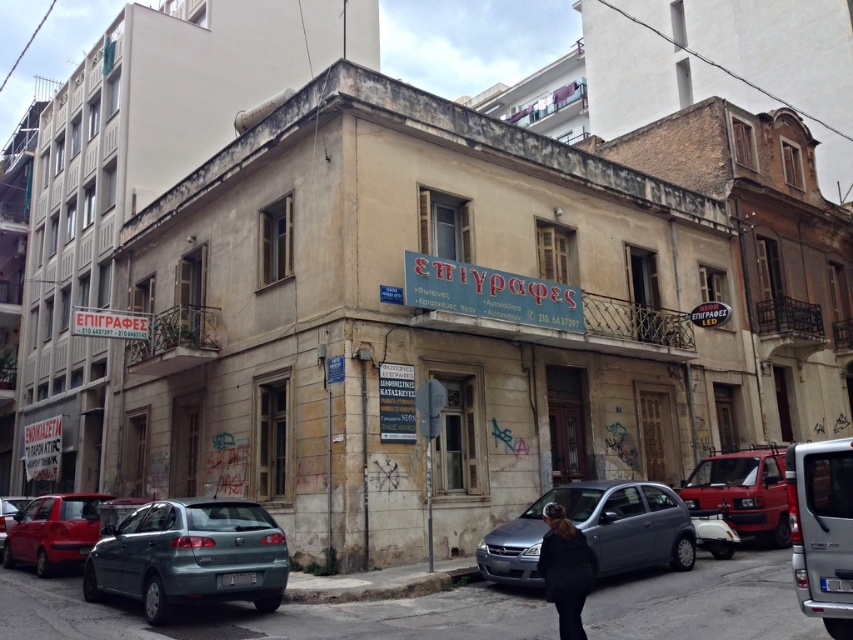
Which of these two, silver metallic van at lower right or matte red van at center, stands shorter?

Standing shorter between the two is silver metallic van at lower right.

Between point (796, 461) and point (762, 483), which one is positioned in front?

Point (796, 461) is in front.

What are the coordinates of `silver metallic van at lower right` in the screenshot? It's located at (822, 529).

Can you confirm if matte red car at lower left is positioned to the right of shiny red sedan at lower left?

Yes, matte red car at lower left is to the right of shiny red sedan at lower left.

Who is positioned more to the right, matte red car at lower left or shiny red sedan at lower left?

matte red car at lower left is more to the right.

Does point (71, 497) lie behind point (4, 518)?

No, it is in front of (4, 518).

Where is `matte red car at lower left`? matte red car at lower left is located at coordinates (53, 531).

Consider the image. Can you confirm if blue metallic car at center is smaller than dark brown fur coat at lower center?

Actually, blue metallic car at center might be larger than dark brown fur coat at lower center.

Can you confirm if blue metallic car at center is positioned to the left of dark brown fur coat at lower center?

Incorrect, blue metallic car at center is not on the left side of dark brown fur coat at lower center.

Between point (660, 560) and point (573, 548), which one is positioned behind?

Positioned behind is point (660, 560).

I want to click on blue metallic car at center, so click(x=595, y=531).